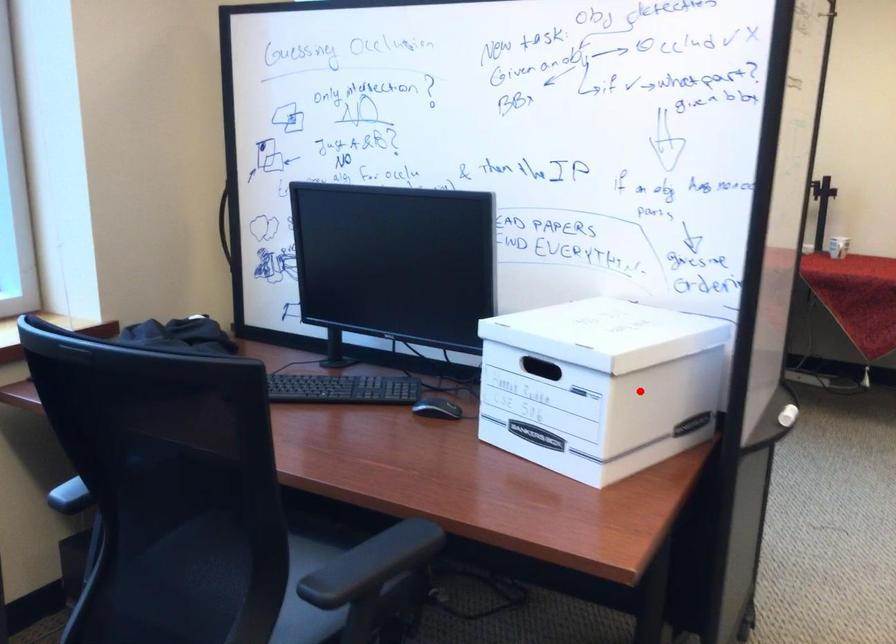
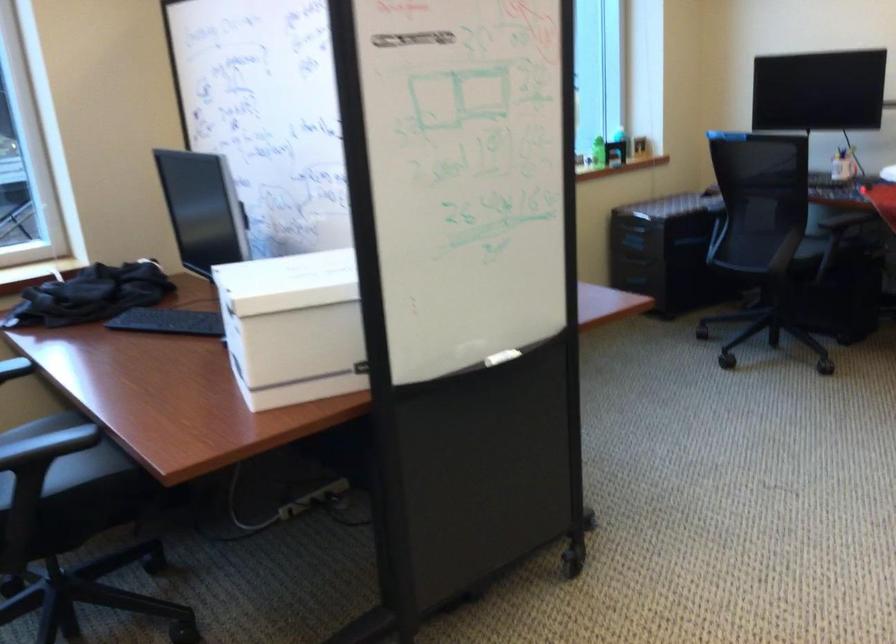
Question: I am providing you with two images of the same scene from different viewpoints. A red point is shown in image1. For the corresponding object point in image2, is it positioned nearer or farther from the camera?

Choices:
 (A) Nearer
 (B) Farther

Answer: (B)